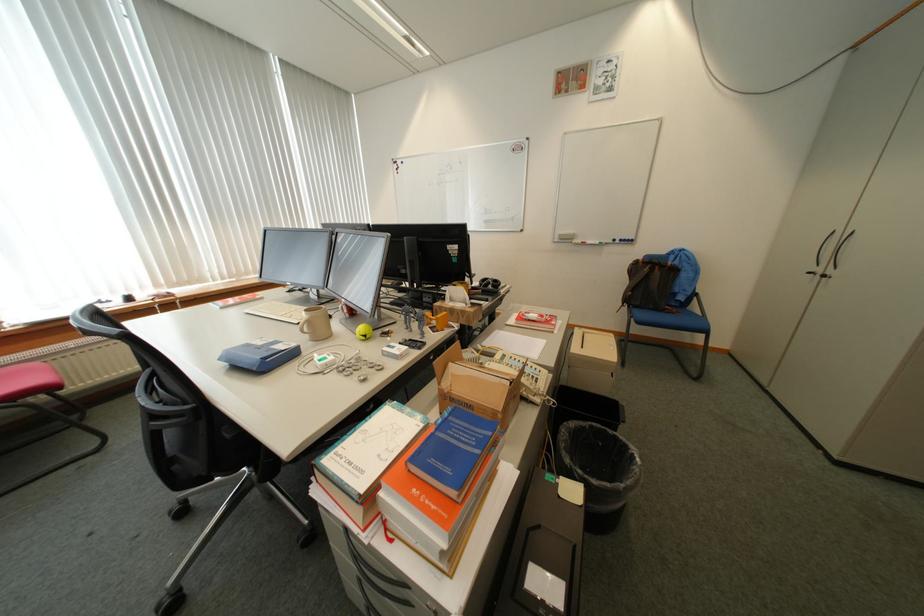
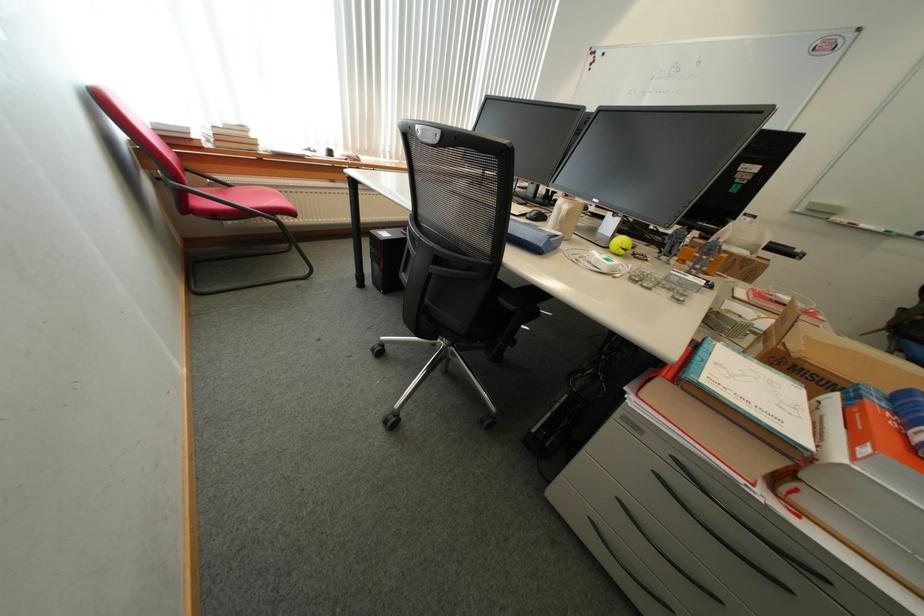
Where in the second image is the point corresponding to (566,238) from the first image?

(815, 207)